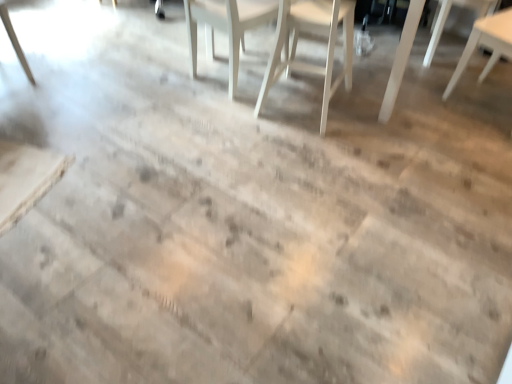
Question: Is white wood chair at center, the 4th chair positioned from the right, taller than light brown wood table at lower left?

Choices:
 (A) no
 (B) yes

Answer: (B)

Question: From a real-world perspective, is white wood chair at center, the first chair when ordered from left to right, on top of light brown wood table at lower left?

Choices:
 (A) no
 (B) yes

Answer: (B)

Question: From a real-world perspective, is white wood chair at center, the first chair when ordered from left to right, physically below light brown wood table at lower left?

Choices:
 (A) yes
 (B) no

Answer: (B)

Question: Considering the relative sizes of white wood chair at center, the 4th chair positioned from the right, and light brown wood table at lower left in the image provided, is white wood chair at center, the 4th chair positioned from the right, wider than light brown wood table at lower left?

Choices:
 (A) yes
 (B) no

Answer: (A)

Question: Can you confirm if white wood chair at center, the first chair when ordered from left to right, is positioned to the left of light brown wood table at lower left?

Choices:
 (A) no
 (B) yes

Answer: (A)

Question: From a real-world perspective, is light brown wood table at lower left positioned above or below white wood chair at center, the 4th chair positioned from the right?

Choices:
 (A) below
 (B) above

Answer: (A)

Question: Is light brown wood table at lower left in front of or behind white wood chair at center, the 4th chair positioned from the right, in the image?

Choices:
 (A) front
 (B) behind

Answer: (A)

Question: Looking at their shapes, would you say light brown wood table at lower left is wider or thinner than white wood chair at center, the 4th chair positioned from the right?

Choices:
 (A) thin
 (B) wide

Answer: (A)

Question: Based on their positions, is light brown wood table at lower left located to the left or right of white wood chair at center, the 4th chair positioned from the right?

Choices:
 (A) right
 (B) left

Answer: (B)

Question: From a real-world perspective, relative to white wood chair at upper right, placed as the 2th chair when sorted from right to left, is white wood chair at center, the first chair when ordered from left to right, vertically above or below?

Choices:
 (A) below
 (B) above

Answer: (B)

Question: From the image's perspective, is white wood chair at center, the 4th chair positioned from the right, located above or below white wood chair at upper right, placed as the 2th chair when sorted from right to left?

Choices:
 (A) below
 (B) above

Answer: (A)

Question: In terms of width, does white wood chair at center, the first chair when ordered from left to right, look wider or thinner when compared to white wood chair at upper right, the third chair in the left-to-right sequence?

Choices:
 (A) thin
 (B) wide

Answer: (A)

Question: From their relative heights in the image, would you say white wood chair at center, the first chair when ordered from left to right, is taller or shorter than white wood chair at upper right, placed as the 2th chair when sorted from right to left?

Choices:
 (A) tall
 (B) short

Answer: (A)

Question: Is white wood chair at upper right, positioned as the 1th chair in right-to-left order, taller or shorter than white wood chair at upper right, the third chair in the left-to-right sequence?

Choices:
 (A) tall
 (B) short

Answer: (A)

Question: From a real-world perspective, relative to white wood chair at upper right, the third chair in the left-to-right sequence, is white wood chair at upper right, positioned as the 1th chair in right-to-left order, vertically above or below?

Choices:
 (A) above
 (B) below

Answer: (A)